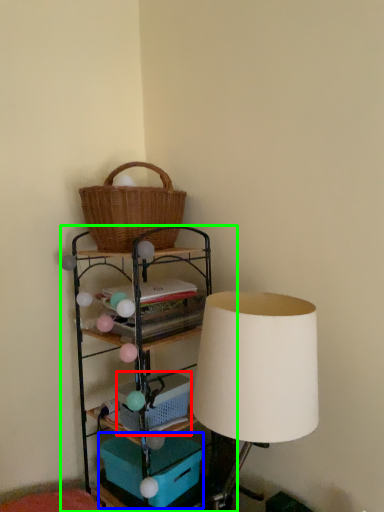
Question: Which object is positioned closest to basket (highlighted by a red box)? Select from storage box (highlighted by a blue box) and shelf (highlighted by a green box).

Choices:
 (A) storage box
 (B) shelf

Answer: (B)